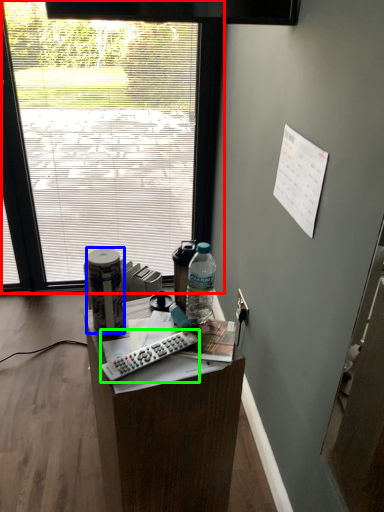
Question: Based on their relative distances, which object is farther from window (highlighted by a red box)? Choose from bottle (highlighted by a blue box) and remote control (highlighted by a green box).

Choices:
 (A) bottle
 (B) remote control

Answer: (B)